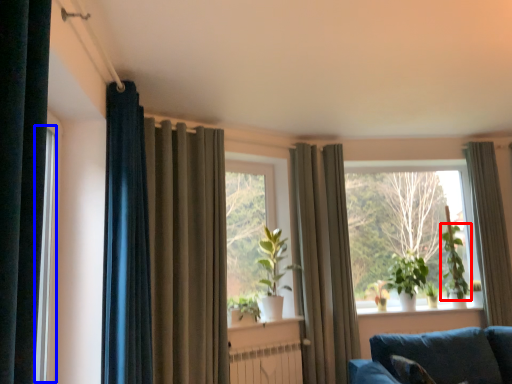
Question: Among these objects, which one is nearest to the camera, plant (highlighted by a red box) or window frame (highlighted by a blue box)?

Choices:
 (A) plant
 (B) window frame

Answer: (B)